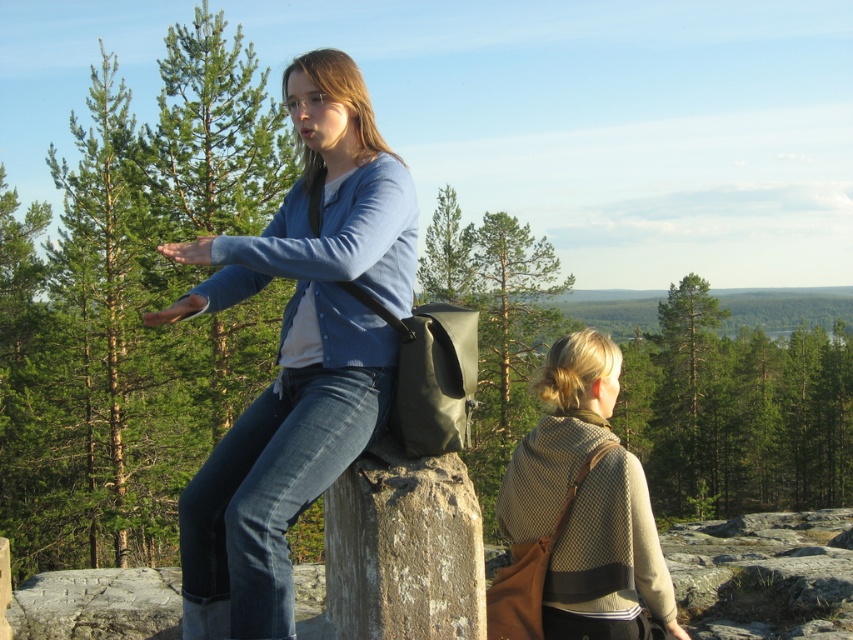
Question: Where is matte blue shirt at center located in relation to beige woolen shawl at center in the image?

Choices:
 (A) above
 (B) below

Answer: (A)

Question: Can you confirm if matte blue shirt at center is wider than beige woolen shawl at center?

Choices:
 (A) no
 (B) yes

Answer: (A)

Question: Which point is closer to the camera taking this photo?

Choices:
 (A) (283, 358)
 (B) (589, 339)

Answer: (A)

Question: Is matte blue shirt at center positioned before beige woolen shawl at center?

Choices:
 (A) no
 (B) yes

Answer: (B)

Question: Which of the following is the farthest from the observer?

Choices:
 (A) (601, 417)
 (B) (308, 234)

Answer: (A)